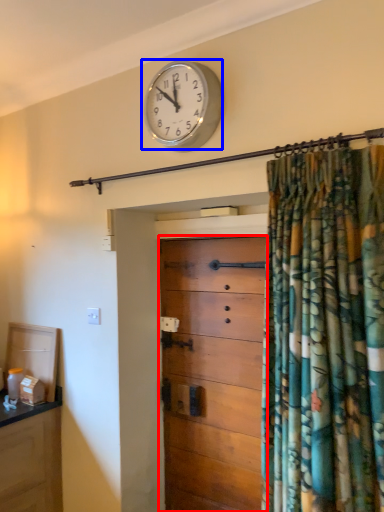
Question: Which object is closer to the camera taking this photo, chest of drawers (highlighted by a red box) or wall clock (highlighted by a blue box)?

Choices:
 (A) chest of drawers
 (B) wall clock

Answer: (B)